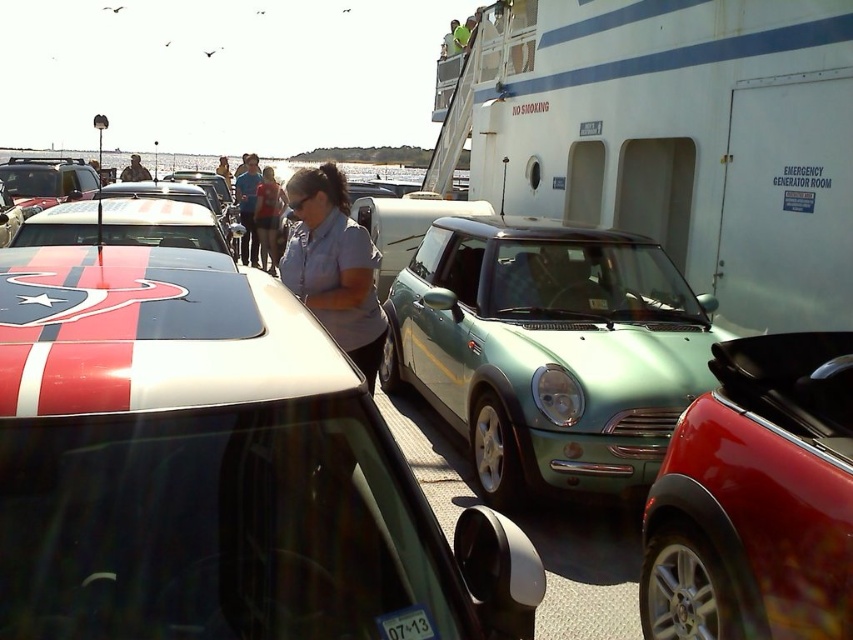
You are a photographer trying to capture both the shiny red convertible at center and the denim jacket at center in a single frame. Which object should you focus on first to ensure both are in the frame?

Since the shiny red convertible at center occupies less space than the denim jacket at center, you should focus on the shiny red convertible at center first to ensure both fit within the frame.

You are standing at the ferry dock and want to take a photo of the two points mentioned. Which point is closer to you, point (289,260) or point (265,257)?

Point (289,260) is closer to the viewer than point (265,257), so you should focus your camera on that point first.